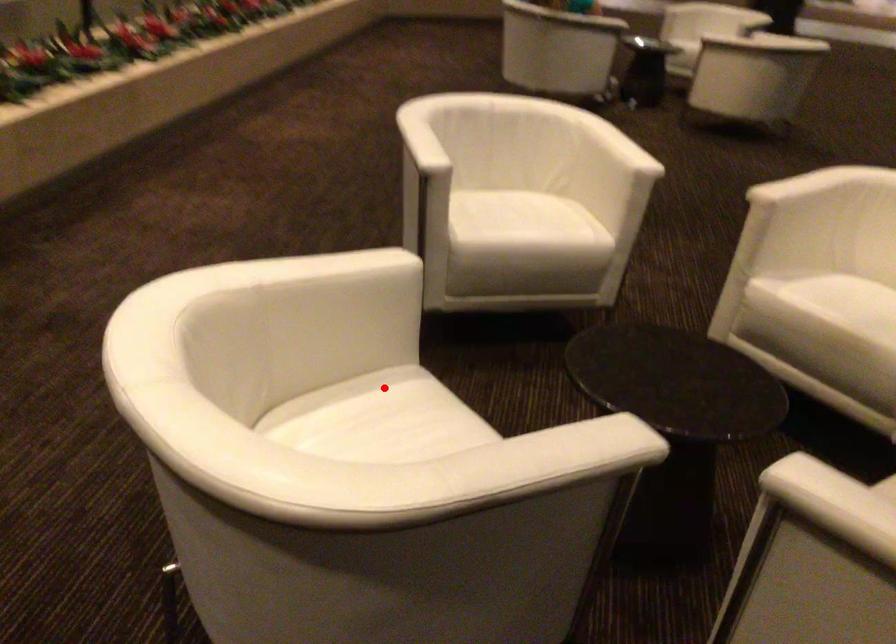
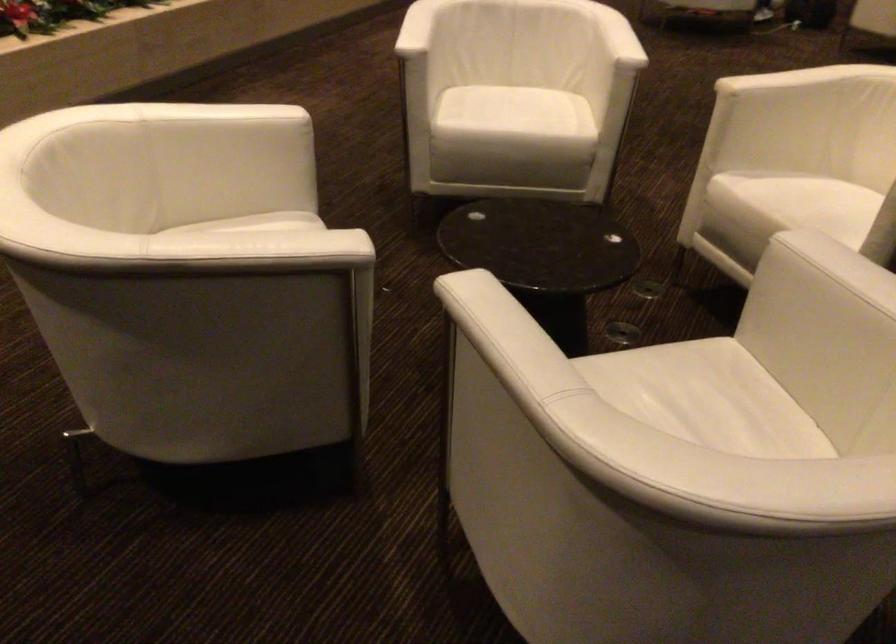
Locate, in the second image, the point that corresponds to the highlighted location in the first image.

(265, 223)